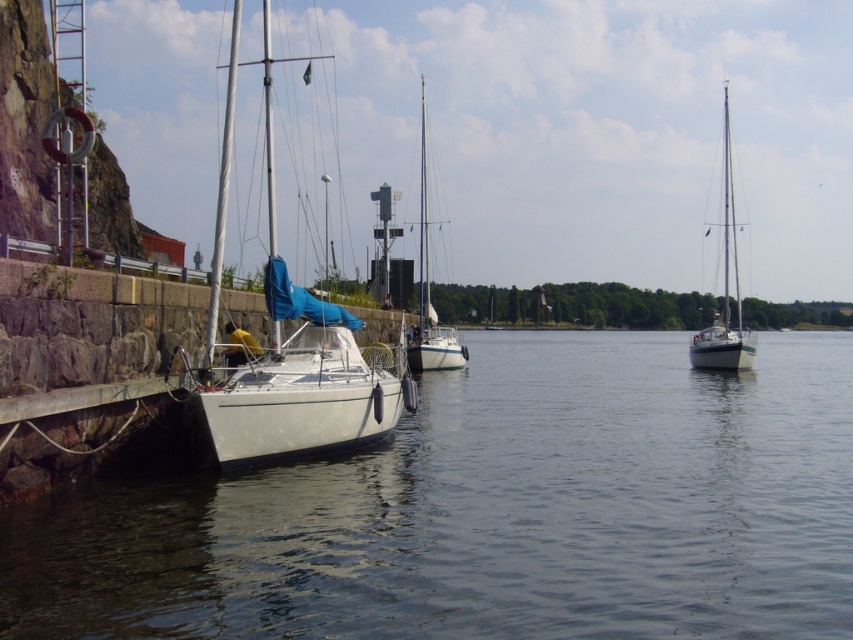
From the picture: Is clear water at dock left below white glossy sailboat at center?

Correct, clear water at dock left is located below white glossy sailboat at center.

Describe the element at coordinates (492, 513) in the screenshot. I see `clear water at dock left` at that location.

Describe the element at coordinates (492, 513) in the screenshot. I see `clear water at dock left` at that location.

Locate an element on the screen. The width and height of the screenshot is (853, 640). clear water at dock left is located at coordinates (492, 513).

Which is above, white matte sailboat at left or white glossy sailboat at right?

white matte sailboat at left is above.

Does point (265, 81) lie in front of point (695, 368)?

No, (265, 81) is further to viewer.

In order to click on white matte sailboat at left in this screenshot , I will do `click(292, 348)`.

Who is more distant from viewer, (627,380) or (392,388)?

The point (627,380) is more distant.

Between point (425, 525) and point (280, 364), which one is positioned in front?

Point (425, 525)

You are a GUI agent. You are given a task and a screenshot of the screen. Output one action in this format:
    pyautogui.click(x=<x>, y=<y>)
    Task: Click on the clear water at dock left
    
    Given the screenshot: What is the action you would take?
    pyautogui.click(x=492, y=513)